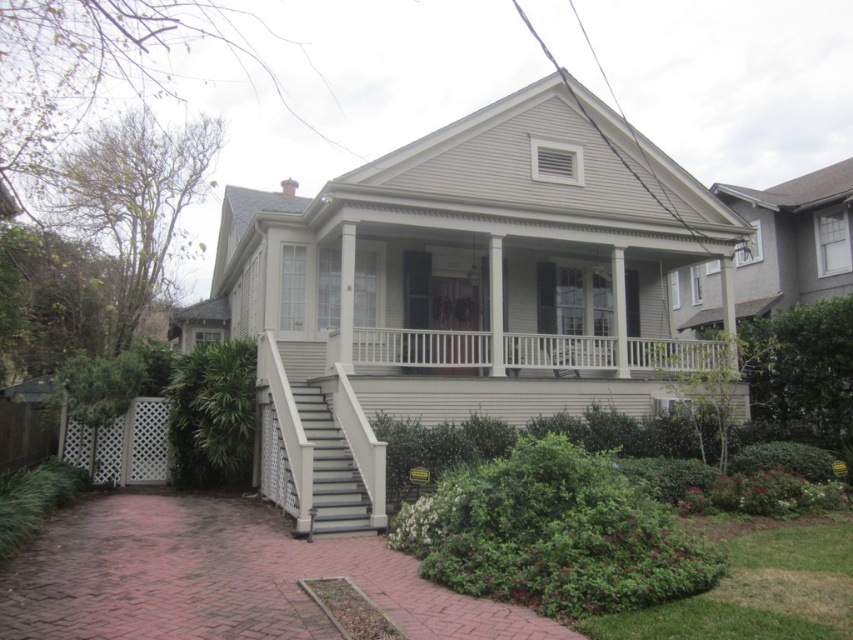
You are standing on the sidewalk in front of the house and want to enter through the front door. Which object do you need to step onto first, the smooth gray porch at center or the gray painted wood stairs at lower left?

You need to step onto the gray painted wood stairs at lower left first because the smooth gray porch at center is in front of them, meaning the stairs are lower and closer to the sidewalk.

You are standing at the entrance of the house and want to walk onto the smooth gray porch at center. Based on the coordinates provided, can you determine if the porch is directly in front of you or to your side?

The smooth gray porch at center is located at coordinates point (456,401), which indicates it is positioned directly in front of you rather than to your side.

You are standing on the ground in front of the house and want to reach the smooth gray porch at center. The gray painted wood stairs at lower left are the only way to get there. How many steps do you need to climb to reach the porch?

The smooth gray porch at center is much taller than the gray painted wood stairs at lower left, so you would need to climb several steps to reach the porch.